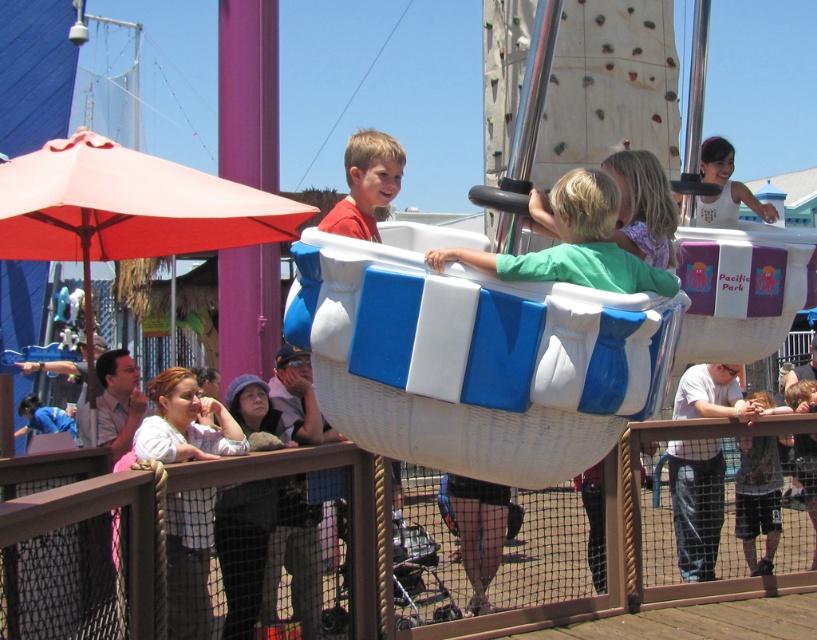
Question: Among these points, which one is nearest to the camera?

Choices:
 (A) (771, 480)
 (B) (695, 538)

Answer: (B)

Question: Which point is farther to the camera?

Choices:
 (A) (387, 195)
 (B) (529, 257)

Answer: (A)

Question: Which object is the farthest from the white cotton shirt at center?

Choices:
 (A) green matte shirt at center
 (B) matte red shirt at center

Answer: (A)

Question: Is green matte shirt at center closer to the viewer compared to matte red shirt at center?

Choices:
 (A) yes
 (B) no

Answer: (A)

Question: In this image, where is green matte shirt at center located relative to matte red shirt at center?

Choices:
 (A) left
 (B) right

Answer: (B)

Question: In this image, where is white cotton shirt at center located relative to camouflage-patterned shorts at lower right?

Choices:
 (A) right
 (B) left

Answer: (B)